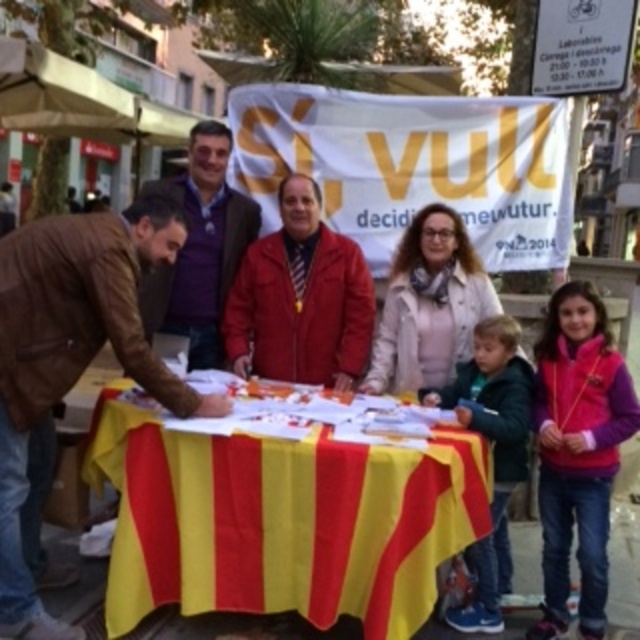
You are standing at the point with coordinates point (216, 609) and want to walk to the point with coordinates point (604, 387). Which direction should you move in?

You should move backward because point (216, 609) is in front of point (604, 387).